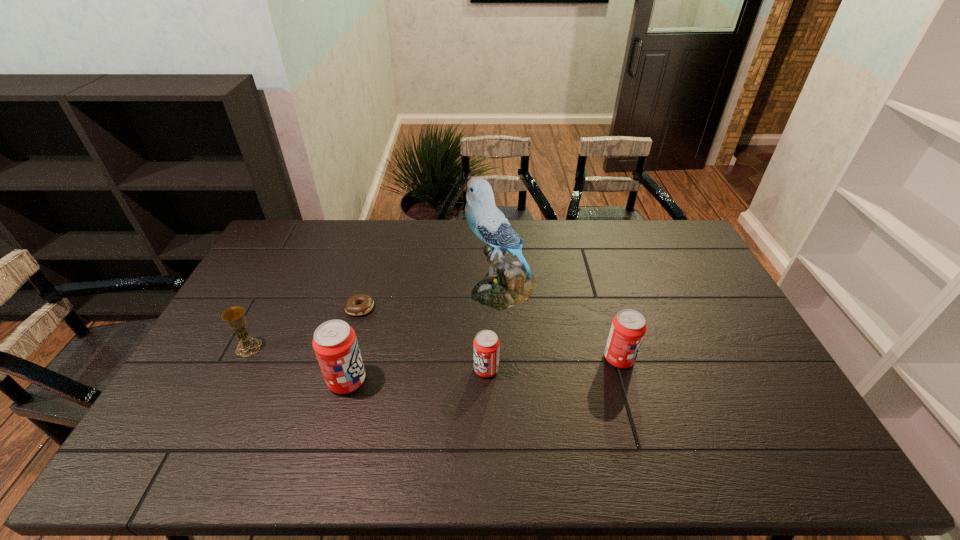
This screenshot has width=960, height=540. Identify the location of vacant space in between the doughnut and the chalice. (304, 327).

Image resolution: width=960 pixels, height=540 pixels. I want to click on object that is the third closest to the leftmost object, so click(506, 284).

Choose which object is the second nearest neighbor to the shortest object. Please provide its 2D coordinates. Your answer should be formatted as a tuple, i.e. [(x, y)], where the tuple contains the x and y coordinates of a point satisfying the conditions above.

[(235, 318)]

Where is `the second closest soda can to the second soda can from left to right`? The width and height of the screenshot is (960, 540). the second closest soda can to the second soda can from left to right is located at coordinates (628, 328).

The width and height of the screenshot is (960, 540). What are the coordinates of `soda can that is the second nearest to the parakeet` in the screenshot? It's located at (628, 328).